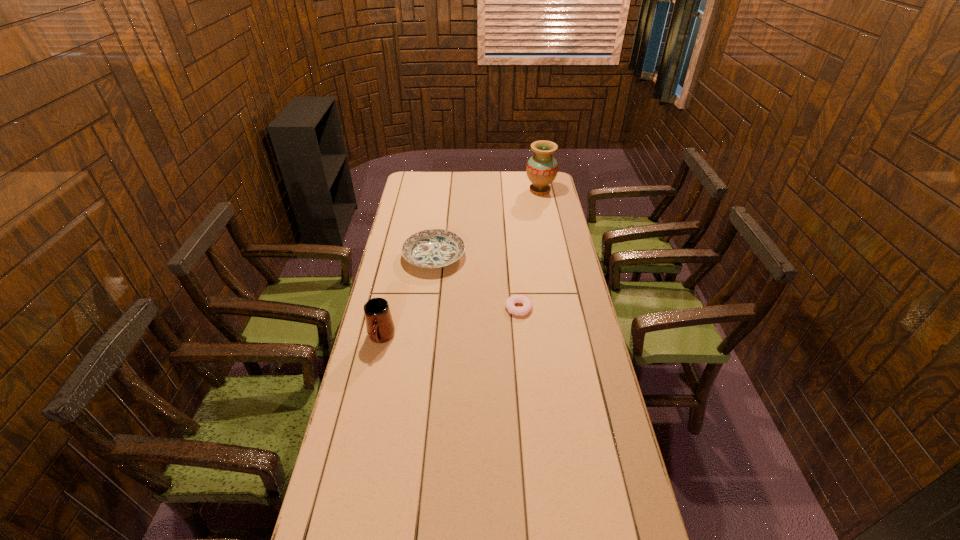
Locate an element on the screen. vacant space that is in between the nearest object and the rightmost object is located at coordinates (461, 264).

Identify the location of vacant point located between the farthest object and the plate. (487, 223).

Locate an element on the screen. unoccupied area between the third nearest object and the doughnut is located at coordinates (476, 282).

At what (x,y) coordinates should I click in order to perform the action: click on empty location between the third farthest object and the rightmost object. Please return your answer as a coordinate pair (x, y). The width and height of the screenshot is (960, 540). Looking at the image, I should click on (529, 249).

I want to click on free space between the tallest object and the nearest object, so click(461, 264).

Where is `vacant space that's between the third farthest object and the mug`? Image resolution: width=960 pixels, height=540 pixels. vacant space that's between the third farthest object and the mug is located at coordinates (450, 323).

This screenshot has width=960, height=540. In order to click on free area in between the nearest object and the second nearest object in this screenshot , I will do `click(450, 323)`.

Image resolution: width=960 pixels, height=540 pixels. Find the location of `free point between the tallest object and the plate`. free point between the tallest object and the plate is located at coordinates (487, 223).

The height and width of the screenshot is (540, 960). I want to click on free space between the nearest object and the third tallest object, so click(x=408, y=297).

At what (x,y) coordinates should I click in order to perform the action: click on free space between the vase and the third nearest object. Please return your answer as a coordinate pair (x, y). Looking at the image, I should click on (487, 223).